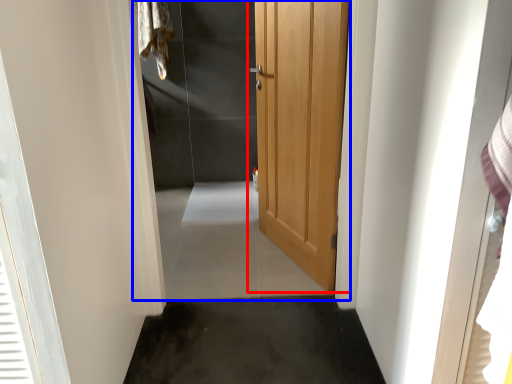
Question: Which object is further to the camera taking this photo, door (highlighted by a red box) or elevator (highlighted by a blue box)?

Choices:
 (A) door
 (B) elevator

Answer: (A)